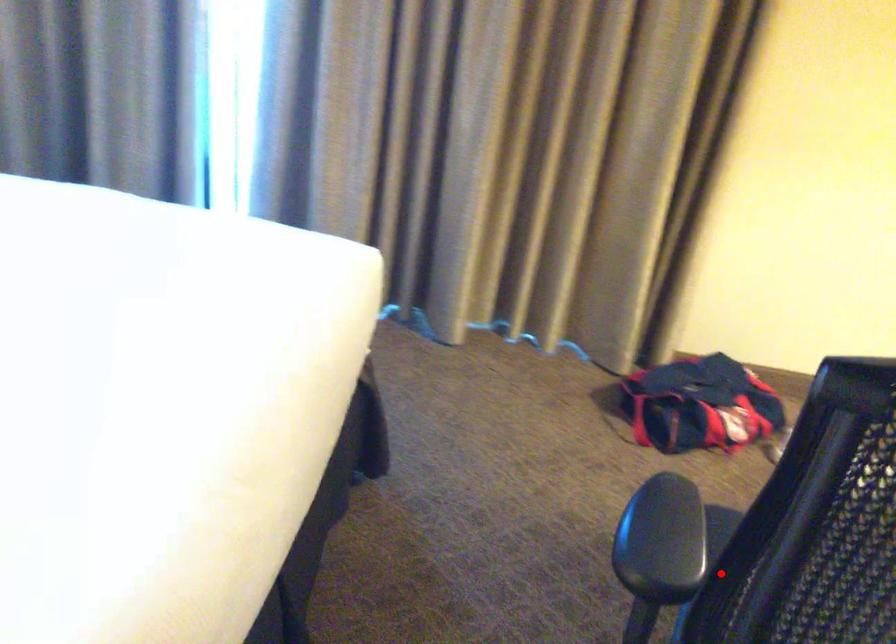
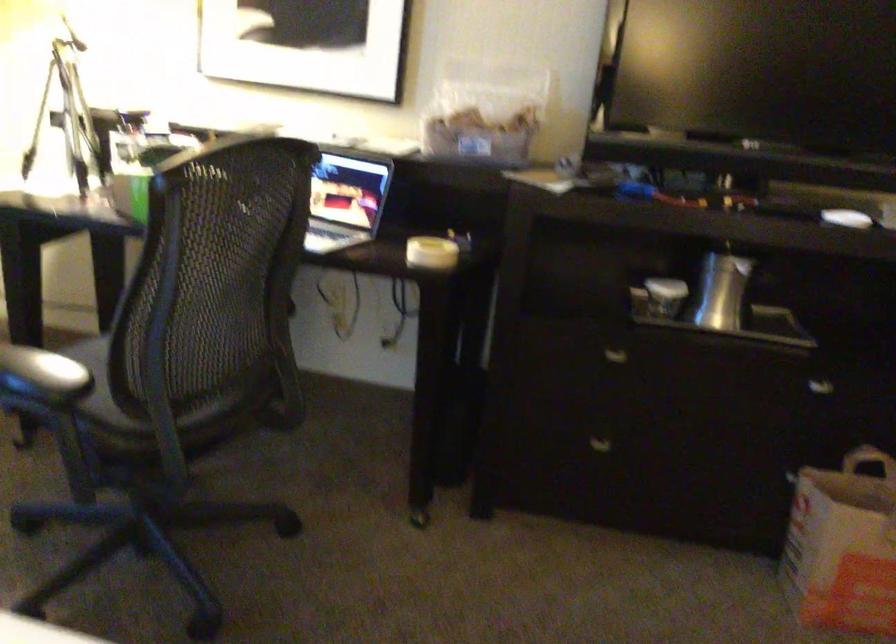
Find the pixel in the second image that matches the highlighted location in the first image.

(124, 346)